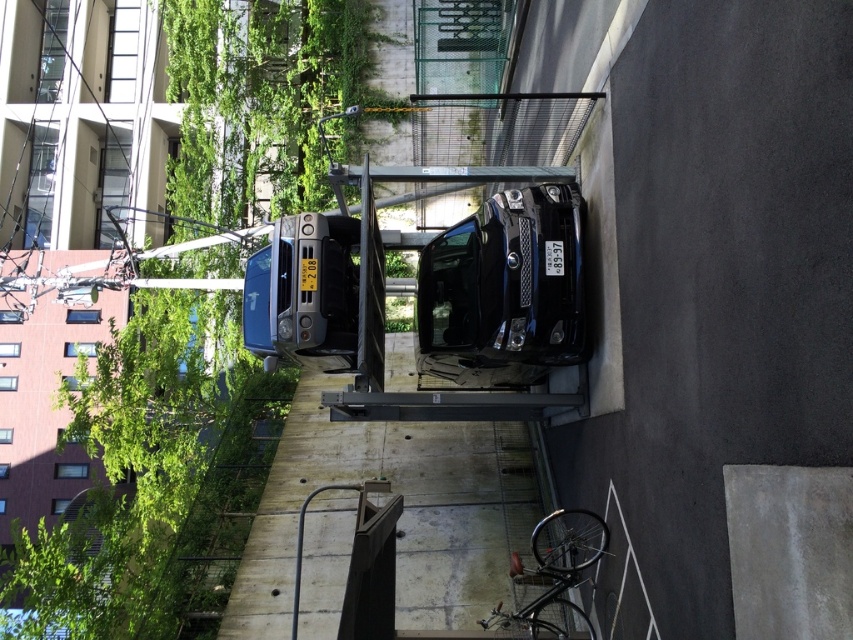
You are a delivery driver who needs to ensure there is enough space between the green leafy vegetation at upper left and the concrete wall at center to maneuver your truck. Can you determine if there is sufficient space between them?

The green leafy vegetation at upper left is positioned on the left side of concrete wall at center, so there is space between them for the truck to maneuver.